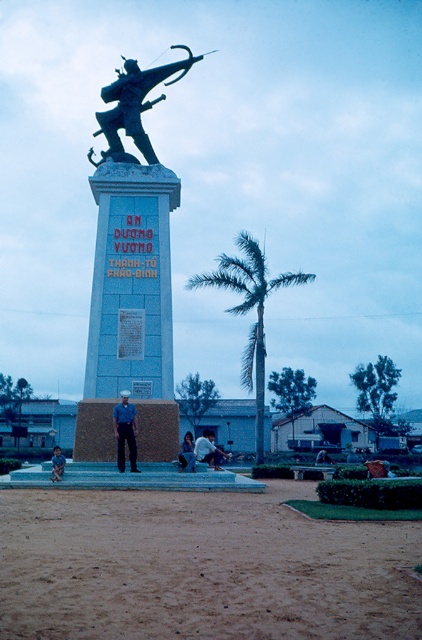
Which is in front, point (256, 340) or point (116, 458)?

Positioned in front is point (116, 458).

Between point (251, 356) and point (134, 436), which one is positioned behind?

The point (251, 356) is more distant.

Between point (259, 308) and point (135, 460), which one is positioned behind?

Positioned behind is point (259, 308).

Where is `green leafy palm tree at center`? The width and height of the screenshot is (422, 640). green leafy palm tree at center is located at coordinates (249, 308).

Consider the image. Measure the distance between green leafy palm tree at center and camera.

green leafy palm tree at center and camera are 83.84 meters apart from each other.

Can you confirm if green leafy palm tree at center is positioned above white fabric shirt at lower center?

Indeed, green leafy palm tree at center is positioned over white fabric shirt at lower center.

Which is behind, point (241, 376) or point (203, 429)?

The point (241, 376) is more distant.

You are a GUI agent. You are given a task and a screenshot of the screen. Output one action in this format:
    pyautogui.click(x=<x>, y=<y>)
    Task: Click on the green leafy palm tree at center
    This screenshot has height=640, width=422.
    Given the screenshot: What is the action you would take?
    pyautogui.click(x=249, y=308)

Can you confirm if polished bronze statue at center is bigger than blue uniform at center?

Indeed, polished bronze statue at center has a larger size compared to blue uniform at center.

Which is in front, point (146, 88) or point (124, 394)?

Positioned in front is point (124, 394).

Where is `polished bronze statue at center`? polished bronze statue at center is located at coordinates (134, 106).